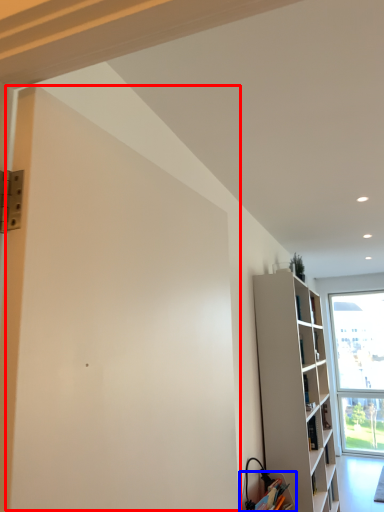
Question: Which object appears farthest to the camera in this image, screen door (highlighted by a red box) or cabinetry (highlighted by a blue box)?

Choices:
 (A) screen door
 (B) cabinetry

Answer: (B)